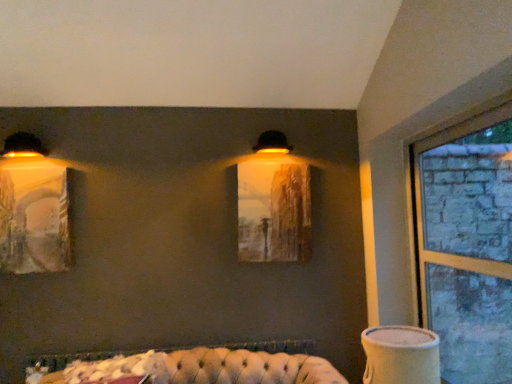
Question: Is white ceramic vase at lower right to the left or to the right of matte yellow wall sconce at left, the 1th lamp viewed from the left, in the image?

Choices:
 (A) left
 (B) right

Answer: (B)

Question: Is white ceramic vase at lower right inside the boundaries of matte yellow wall sconce at left, the 2th lamp viewed from the top, or outside?

Choices:
 (A) inside
 (B) outside

Answer: (B)

Question: Considering the real-world distances, which object is closest to the matte black lampshade at upper center, which appears as the 1th lamp when viewed from the top?

Choices:
 (A) white ceramic vase at lower right
 (B) matte yellow wall sconce at left, the 1th lamp viewed from the left
 (C) matte glass painting at center
 (D) matte yellow lampshade at left, which is counted as the second lamp, starting from the right
 (E) tufted leather couch at lower center

Answer: (C)

Question: Which object is the farthest from the matte yellow wall sconce at left, the second lamp from the bottom?

Choices:
 (A) clear glass window at right
 (B) tufted leather couch at lower center
 (C) white ceramic vase at lower right
 (D) matte black lampshade at upper center, acting as the 1th lamp starting from the right
 (E) matte glass painting at center

Answer: (A)